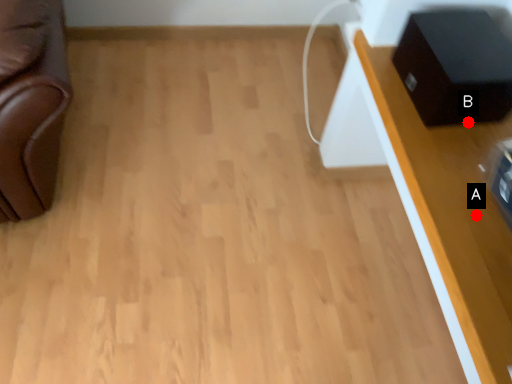
Question: Two points are circled on the image, labeled by A and B beside each circle. Which point appears closest to the camera in this image?

Choices:
 (A) A is closer
 (B) B is closer

Answer: (A)